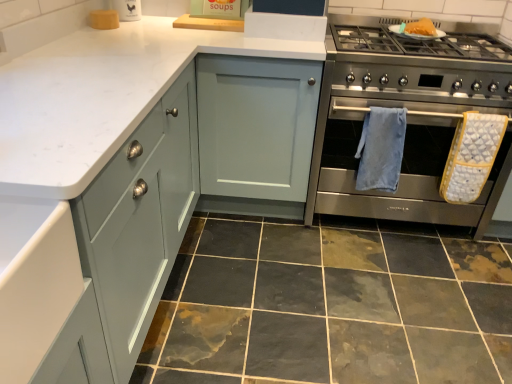
At what (x,y) coordinates should I click in order to perform the action: click on blank space situated above marble tile at lower center (from a real-world perspective). Please return your answer as a coordinate pair (x, y). The height and width of the screenshot is (384, 512). Looking at the image, I should click on (x=352, y=289).